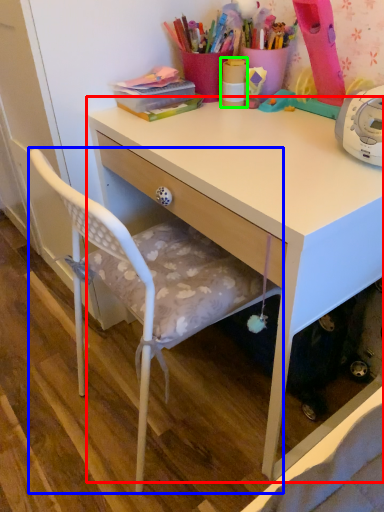
Question: Which object is the closest to the desk (highlighted by a red box)? Choose among these: chair (highlighted by a blue box) or office supplies (highlighted by a green box).

Choices:
 (A) chair
 (B) office supplies

Answer: (A)